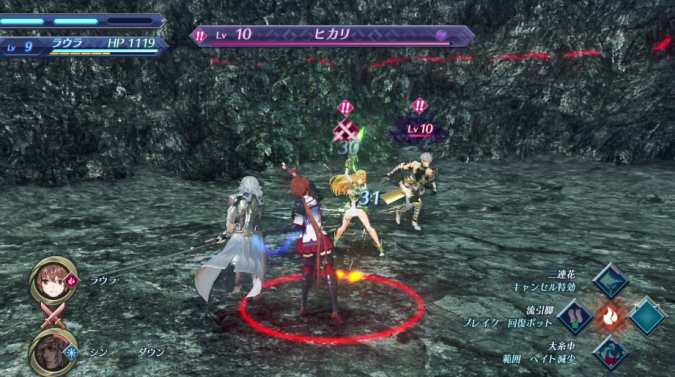
At what (x,y) coordinates should I click in order to perform the action: click on wall. Please return your answer as a coordinate pair (x, y). Image resolution: width=675 pixels, height=377 pixels. Looking at the image, I should click on (489, 66).